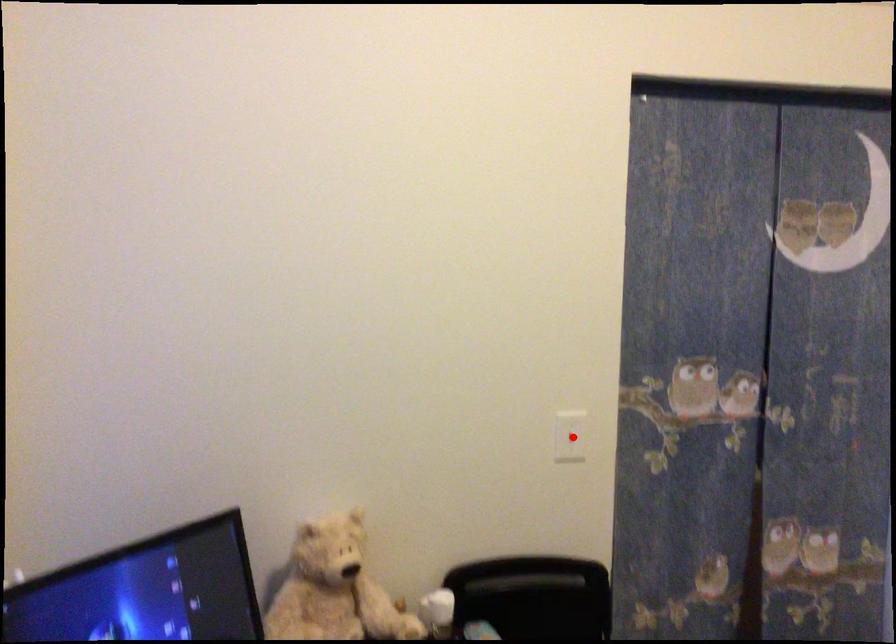
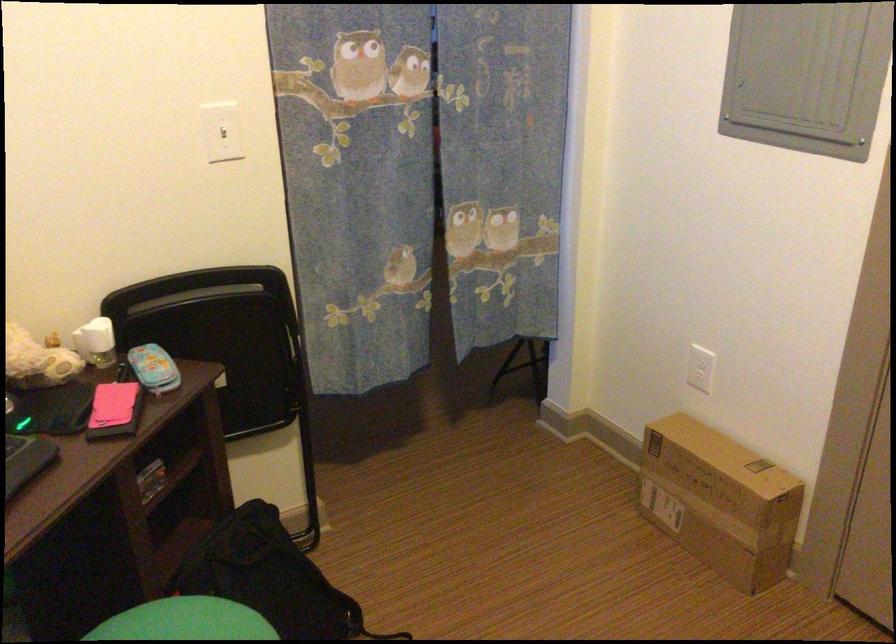
Question: A red point is marked in image1. In image2, is the corresponding 3D point closer to the camera or farther? Reply with the corresponding letter.

Choices:
 (A) The corresponding 3D point is closer.
 (B) The corresponding 3D point is farther.

Answer: (A)